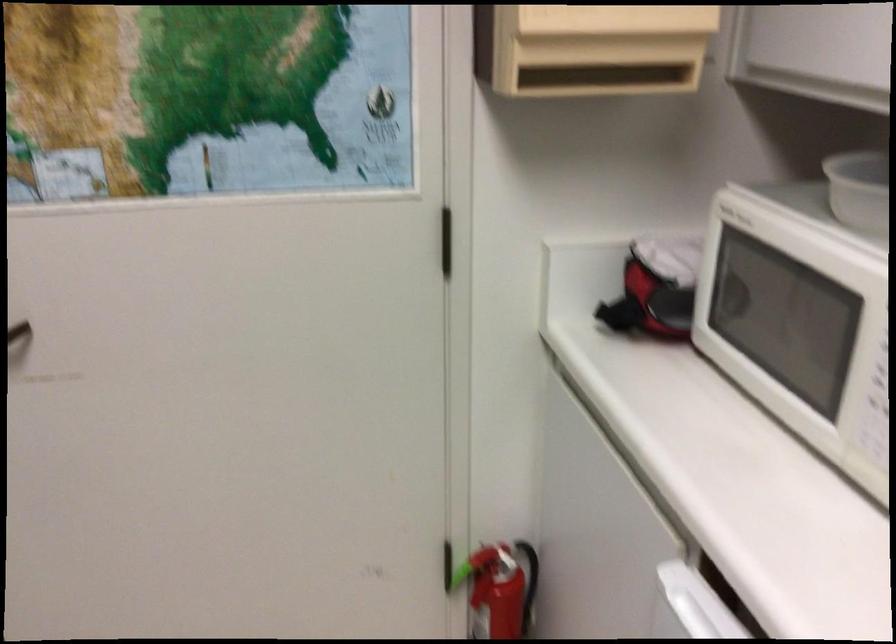
What do you see at coordinates (498, 589) in the screenshot? I see `the fire extinguisher pin` at bounding box center [498, 589].